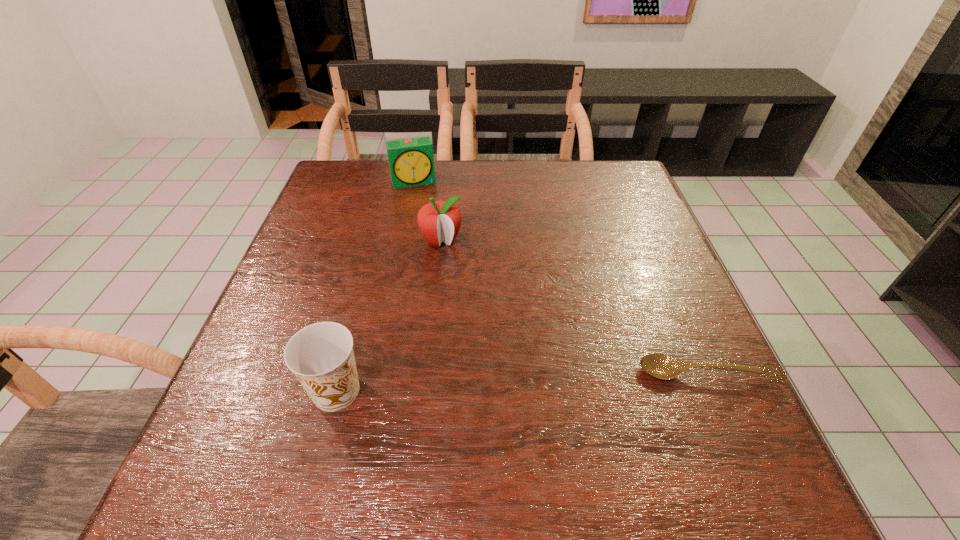
Image resolution: width=960 pixels, height=540 pixels. I want to click on vacant position at the far edge of the desktop, so click(457, 204).

The height and width of the screenshot is (540, 960). In the image, there is a desktop. Find the location of `vacant space at the near edge`. vacant space at the near edge is located at coordinates (422, 402).

Find the location of `vacant area at the left edge`. vacant area at the left edge is located at coordinates (320, 247).

This screenshot has width=960, height=540. I want to click on vacant area at the right edge, so click(596, 214).

In the image, there is a desktop. Where is `vacant space at the far left corner`? This screenshot has width=960, height=540. vacant space at the far left corner is located at coordinates (344, 181).

The width and height of the screenshot is (960, 540). In the image, there is a desktop. In order to click on vacant space at the near right corner in this screenshot , I will do `click(657, 427)`.

You are a GUI agent. You are given a task and a screenshot of the screen. Output one action in this format:
    pyautogui.click(x=<x>, y=<y>)
    Task: Click on the vacant space that is in between the rightmost object and the second farthest object
    
    Given the screenshot: What is the action you would take?
    pyautogui.click(x=574, y=307)

The height and width of the screenshot is (540, 960). Identify the location of vacant space in between the second farthest object and the rightmost object. (574, 307).

The width and height of the screenshot is (960, 540). I want to click on unoccupied area between the third nearest object and the rightmost object, so click(574, 307).

You are a GUI agent. You are given a task and a screenshot of the screen. Output one action in this format:
    pyautogui.click(x=<x>, y=<y>)
    Task: Click on the free spot between the rightmost object and the apple
    This screenshot has width=960, height=540.
    Given the screenshot: What is the action you would take?
    pyautogui.click(x=574, y=307)